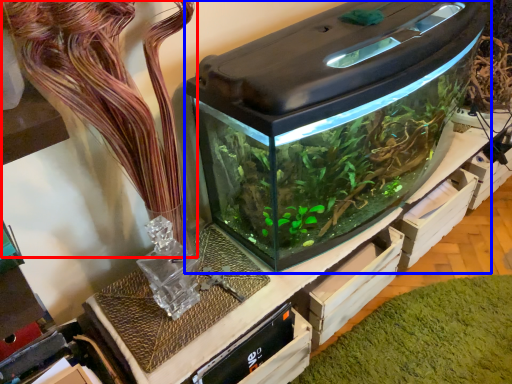
Question: Which object is closer to the camera taking this photo, plant (highlighted by a red box) or home appliance (highlighted by a blue box)?

Choices:
 (A) plant
 (B) home appliance

Answer: (A)